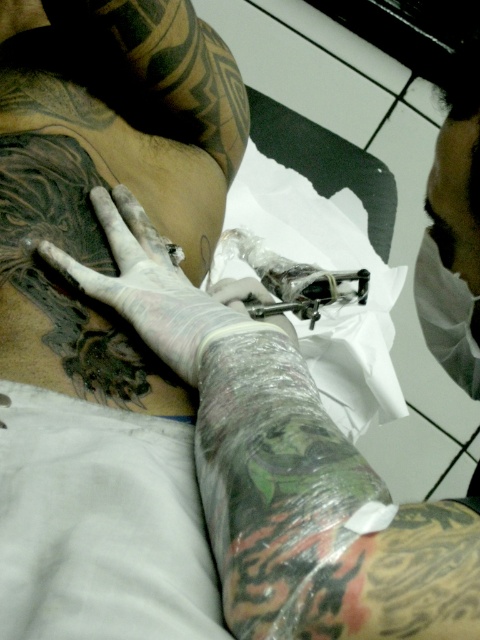
Is point (254, 428) in front of point (165, 314)?

Yes, it is in front of point (165, 314).

Which is below, white latex glove at upper center or white latex glove at center?

white latex glove at upper center is below.

Locate an element on the screen. The width and height of the screenshot is (480, 640). white latex glove at upper center is located at coordinates (282, 477).

Who is taller, white latex glove at center or clear plastic glove at center?

A: Standing taller between the two is white latex glove at center.

Which is behind, point (257, 289) or point (265, 289)?

The point (265, 289) is more distant.

Which is in front, point (120, 236) or point (289, 339)?

Point (120, 236) is in front.

This screenshot has width=480, height=640. I want to click on white latex glove at center, so click(162, 289).

Which is below, white latex glove at upper center or clear plastic glove at center?

white latex glove at upper center

Does white latex glove at upper center have a lesser width compared to clear plastic glove at center?

No.

Locate an element on the screen. This screenshot has height=640, width=480. white latex glove at upper center is located at coordinates (282, 477).

The image size is (480, 640). Identify the location of white latex glove at upper center. (282, 477).